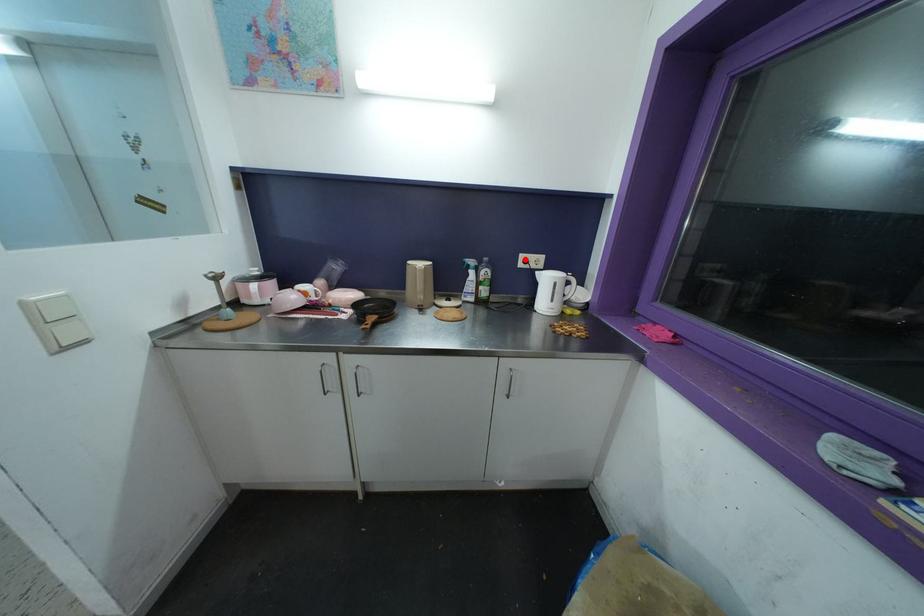
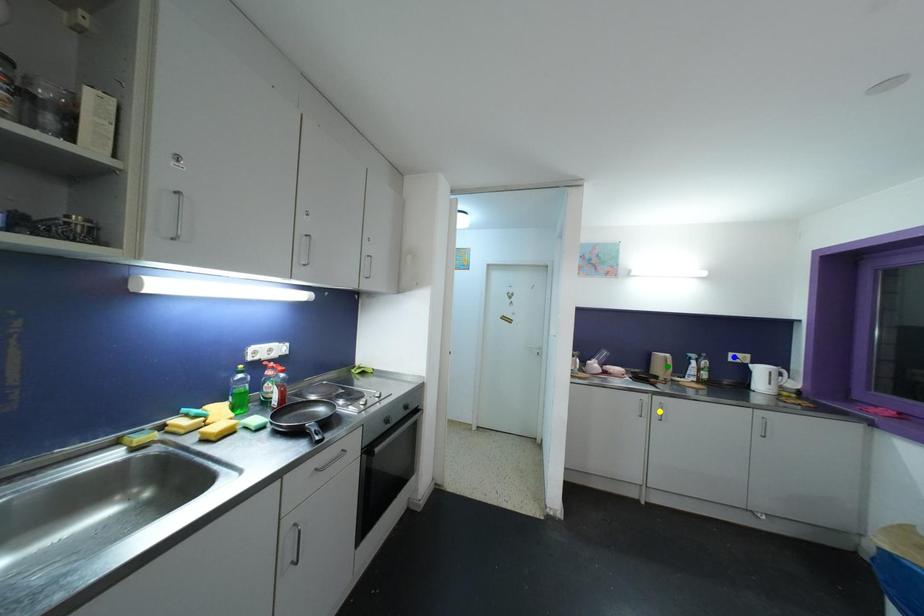
Question: I am providing you with two images of the same scene from different viewpoints. A red point is marked on the first image. You are given multiple points on the second image. In image 2, which mark is for the same physical point as the one in image 1?

Choices:
 (A) green point
 (B) blue point
 (C) yellow point

Answer: (B)